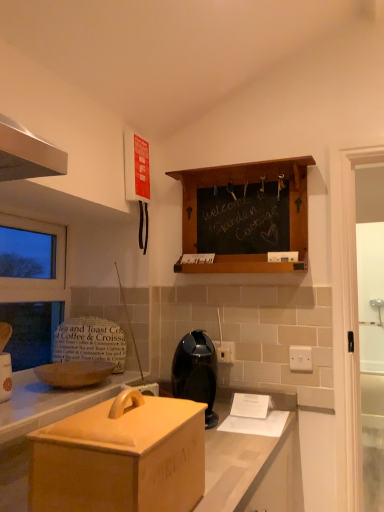
Question: Should I look upward or downward to see matte wooden bread bin at lower left?

Choices:
 (A) up
 (B) down

Answer: (B)

Question: Can you confirm if white plastic electric outlet at center, acting as the second electric outlet starting from the front, is thinner than transparent glass door at right?

Choices:
 (A) yes
 (B) no

Answer: (A)

Question: Does white plastic electric outlet at center, which appears as the first electric outlet when viewed from the left, lie behind transparent glass door at right?

Choices:
 (A) yes
 (B) no

Answer: (B)

Question: Is white plastic electric outlet at center, acting as the second electric outlet starting from the front, far away from transparent glass door at right?

Choices:
 (A) no
 (B) yes

Answer: (A)

Question: Can you confirm if white plastic electric outlet at center, which appears as the first electric outlet when viewed from the left, is bigger than transparent glass door at right?

Choices:
 (A) yes
 (B) no

Answer: (B)

Question: Is white plastic electric outlet at center, which appears as the first electric outlet when viewed from the left, positioned before transparent glass door at right?

Choices:
 (A) yes
 (B) no

Answer: (A)

Question: Could you tell me if white plastic electric outlet at center, the second electric outlet from the right, is turned towards transparent glass door at right?

Choices:
 (A) yes
 (B) no

Answer: (B)

Question: Is transparent glass window at left surrounding matte wooden bread bin at lower left?

Choices:
 (A) no
 (B) yes

Answer: (A)

Question: Is transparent glass window at left completely or partially outside of matte wooden bread bin at lower left?

Choices:
 (A) yes
 (B) no

Answer: (A)

Question: Does transparent glass window at left come behind matte wooden bread bin at lower left?

Choices:
 (A) no
 (B) yes

Answer: (B)

Question: Could you tell me if transparent glass window at left is facing matte wooden bread bin at lower left?

Choices:
 (A) yes
 (B) no

Answer: (B)

Question: Is transparent glass window at left smaller than matte wooden bread bin at lower left?

Choices:
 (A) no
 (B) yes

Answer: (A)

Question: Considering the relative positions of transparent glass window at left and matte wooden bread bin at lower left in the image provided, is transparent glass window at left to the left of matte wooden bread bin at lower left from the viewer's perspective?

Choices:
 (A) no
 (B) yes

Answer: (B)

Question: Is black plastic coffee maker at center to the right of matte wooden bread bin at lower left from the viewer's perspective?

Choices:
 (A) no
 (B) yes

Answer: (B)